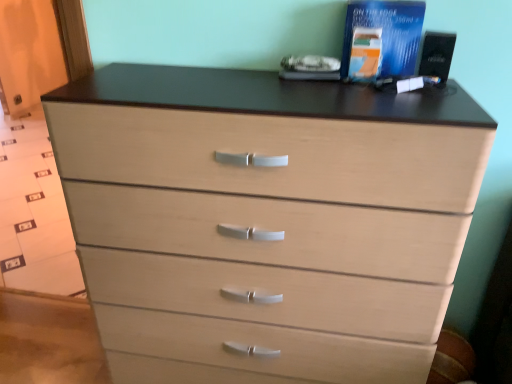
The width and height of the screenshot is (512, 384). Find the location of `vacant space situated on the left part of blue paper at upper right, the second book in the right-to-left sequence`. vacant space situated on the left part of blue paper at upper right, the second book in the right-to-left sequence is located at coordinates (300, 86).